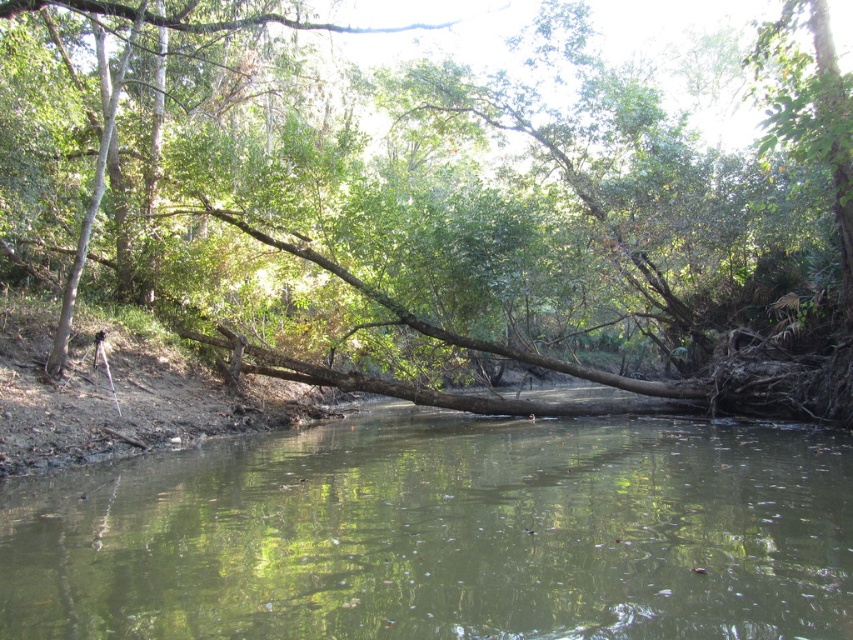
Which is more to the right, brown rough log at center or green muddy river at center?

green muddy river at center

In the scene shown: Does brown rough log at center appear on the right side of green muddy river at center?

Incorrect, brown rough log at center is not on the right side of green muddy river at center.

Is point (723, 394) farther from viewer compared to point (618, 480)?

Yes, point (723, 394) is farther from viewer.

Find the location of `brown rough log at center`. brown rough log at center is located at coordinates (457, 195).